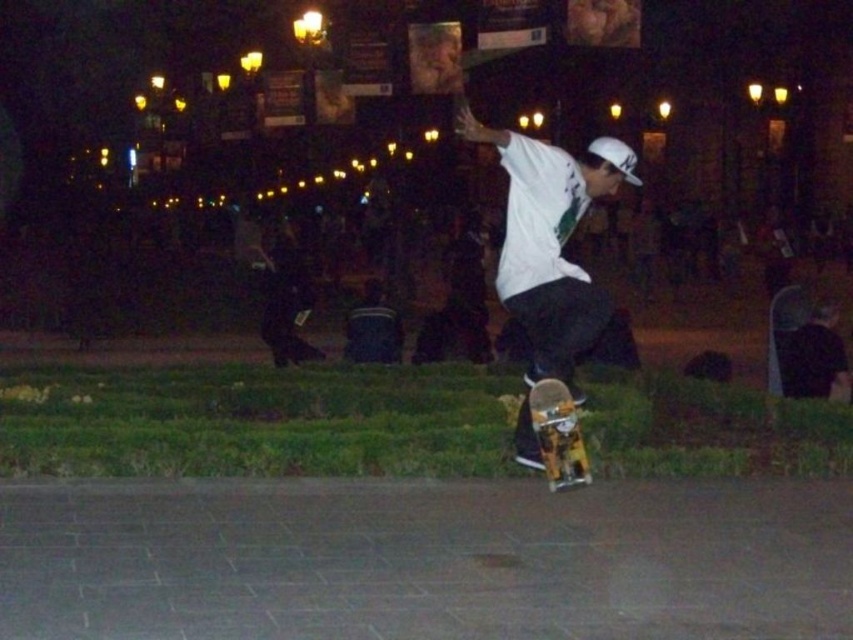
Image resolution: width=853 pixels, height=640 pixels. What do you see at coordinates (550, 241) in the screenshot?
I see `white matte shirt at center` at bounding box center [550, 241].

Who is more distant from viewer, [553,221] or [538,429]?

Positioned behind is point [553,221].

Between point (505, 296) and point (575, 410), which one is positioned behind?

Positioned behind is point (575, 410).

Identify the location of white matte shirt at center. Image resolution: width=853 pixels, height=640 pixels. (550, 241).